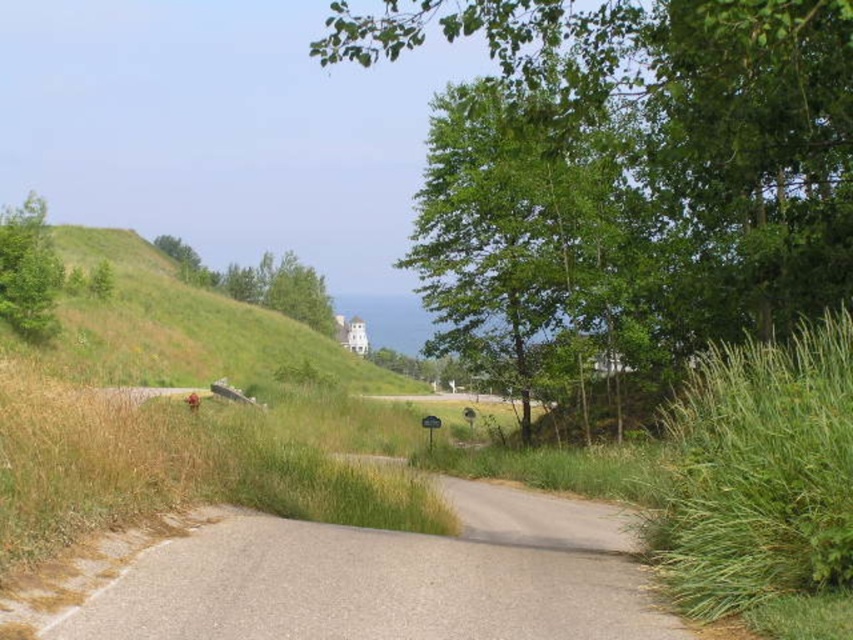
Question: Which object is the farthest from the green leafy tree at left?

Choices:
 (A) green grassy hillside at upper left
 (B) gray asphalt path at center

Answer: (B)

Question: Which point is closer to the camera?

Choices:
 (A) (281, 291)
 (B) (9, 246)
 (C) (627, 532)
 (D) (585, 276)

Answer: (C)

Question: Estimate the real-world distances between objects in this image. Which object is closer to the gray asphalt path at center?

Choices:
 (A) green grassy hillside at upper left
 (B) green leafy tree at upper left

Answer: (A)

Question: Can you confirm if gray asphalt path at center is positioned to the right of green leafy tree at center?

Choices:
 (A) no
 (B) yes

Answer: (A)

Question: Is green leafy tree at upper center smaller than green grassy hillside at upper left?

Choices:
 (A) no
 (B) yes

Answer: (A)

Question: Is green grassy hillside at upper left positioned behind green leafy tree at upper left?

Choices:
 (A) yes
 (B) no

Answer: (B)